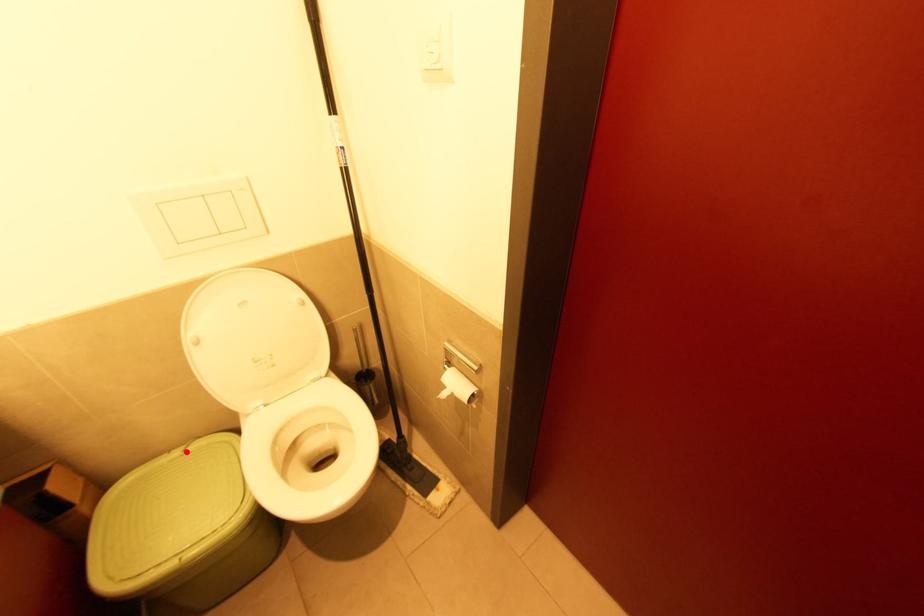
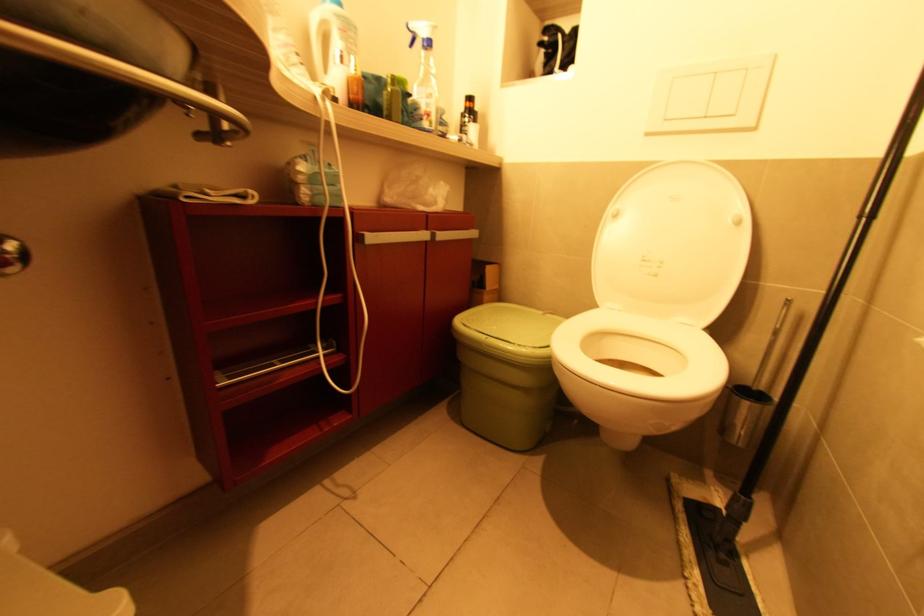
Find the pixel in the second image that matches the highlighted location in the first image.

(545, 314)